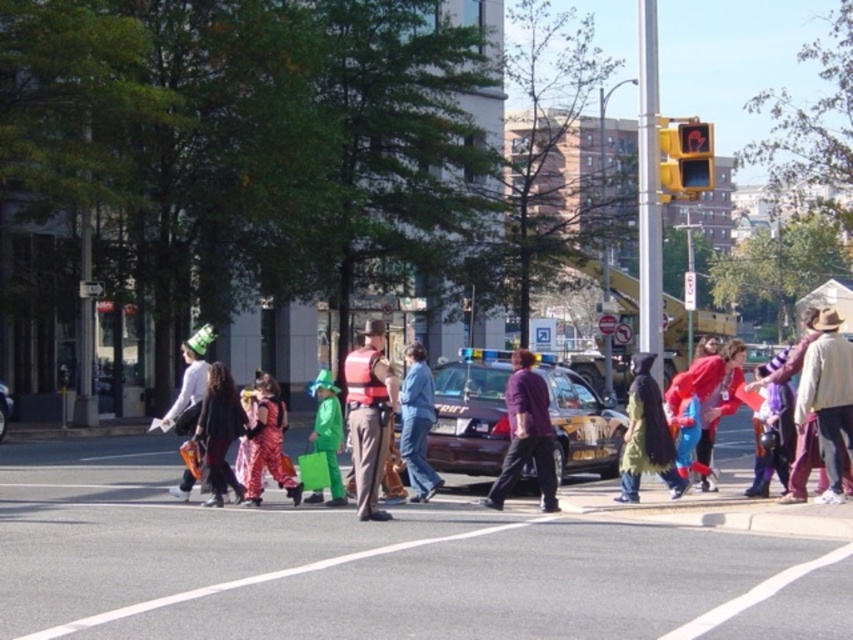
Can you confirm if denim pants at center is taller than matte white shirt at center?

No, denim pants at center is not taller than matte white shirt at center.

Is denim pants at center below matte white shirt at center?

No.

Who is more forward, [416,346] or [204,387]?

Point [204,387]

I want to click on denim pants at center, so click(416, 422).

Which is below, denim pants at center or yellow plastic traffic light at upper right?

denim pants at center is lower down.

Which of these two, denim pants at center or yellow plastic traffic light at upper right, stands taller?

Standing taller between the two is yellow plastic traffic light at upper right.

Which is in front, point (416, 396) or point (688, 138)?

Point (416, 396) is more forward.

Where is `denim pants at center`? denim pants at center is located at coordinates (x=416, y=422).

Image resolution: width=853 pixels, height=640 pixels. Describe the element at coordinates (646, 435) in the screenshot. I see `green fabric cape at center` at that location.

The width and height of the screenshot is (853, 640). I want to click on green fabric cape at center, so [x=646, y=435].